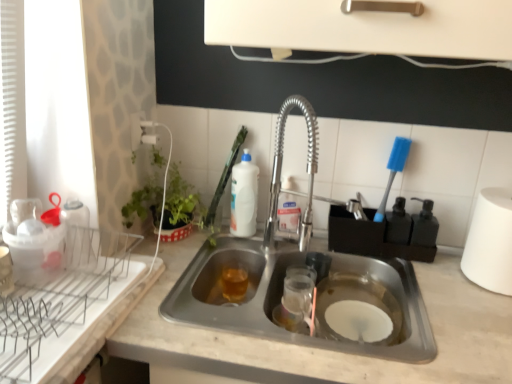
Find the location of a particular element. The width and height of the screenshot is (512, 384). free location to the right of white glossy bottle at upper center, the second beverage positioned from the bottom is located at coordinates (278, 236).